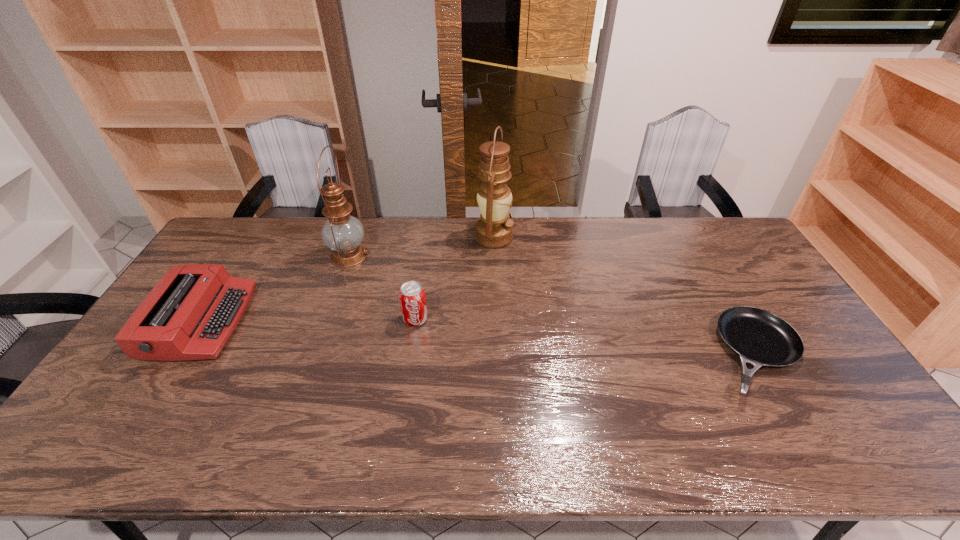
I want to click on object that is the fourth nearest to the fourth object from right to left, so click(x=760, y=338).

Where is `object that is the third closest one to the right oil lamp`? object that is the third closest one to the right oil lamp is located at coordinates (760, 338).

I want to click on vacant space that satisfies the following two spatial constraints: 1. on the typing side of the typewriter; 2. on the left side of the shortest object, so click(x=180, y=354).

Where is `vacant area that satisfies the following two spatial constraints: 1. on the back side of the right oil lamp; 2. on the left side of the third shortest object`? Image resolution: width=960 pixels, height=540 pixels. vacant area that satisfies the following two spatial constraints: 1. on the back side of the right oil lamp; 2. on the left side of the third shortest object is located at coordinates (427, 237).

You are a GUI agent. You are given a task and a screenshot of the screen. Output one action in this format:
    pyautogui.click(x=<x>, y=<y>)
    Task: Click on the free spot that satisfies the following two spatial constraints: 1. on the back side of the second object from right to left; 2. on the left side of the soda
    This screenshot has height=540, width=960.
    Given the screenshot: What is the action you would take?
    [x=427, y=237]

Where is `vacant space that satisfies the following two spatial constraints: 1. on the front side of the third tallest object; 2. on the typing side of the leftmost object`? This screenshot has height=540, width=960. vacant space that satisfies the following two spatial constraints: 1. on the front side of the third tallest object; 2. on the typing side of the leftmost object is located at coordinates (415, 322).

Locate an element on the screen. The width and height of the screenshot is (960, 540). blank area in the image that satisfies the following two spatial constraints: 1. on the back side of the right oil lamp; 2. on the right side of the third object from left to right is located at coordinates (427, 237).

This screenshot has height=540, width=960. What are the coordinates of `vacant area that satisfies the following two spatial constraints: 1. on the typing side of the leftmost object; 2. on the left side of the shortest object` in the screenshot? It's located at (180, 354).

In order to click on vacant space that satisfies the following two spatial constraints: 1. on the typing side of the typewriter; 2. on the back side of the shortest object in this screenshot , I will do `click(180, 354)`.